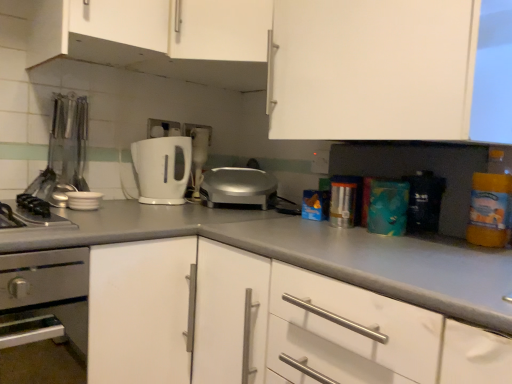
Locate an element on the screen. This screenshot has height=384, width=512. free space in front of white plastic coffee machine at center is located at coordinates (177, 197).